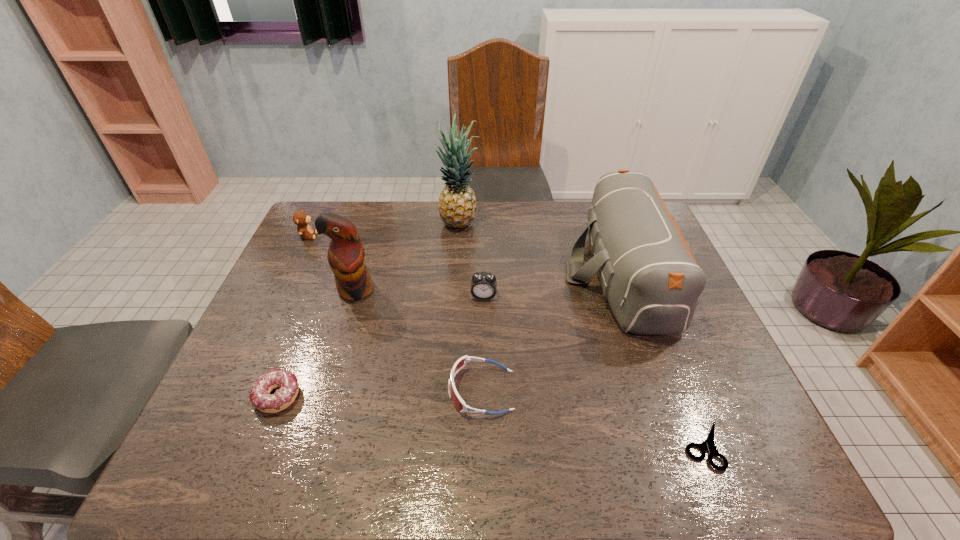
Where is `vacant space that's between the doughnut and the parrot`? This screenshot has width=960, height=540. vacant space that's between the doughnut and the parrot is located at coordinates (317, 343).

Where is `unoccupied position between the goggles and the alarm clock`? unoccupied position between the goggles and the alarm clock is located at coordinates (482, 343).

The height and width of the screenshot is (540, 960). Identify the location of free space between the nearest object and the sixth tallest object. (592, 418).

Identify which object is the sixth closest to the pineapple. Please provide its 2D coordinates. Your answer should be formatted as a tuple, i.e. [(x, y)], where the tuple contains the x and y coordinates of a point satisfying the conditions above.

[(260, 398)]

Identify which object is the seventh closest to the sixth tallest object. Please provide its 2D coordinates. Your answer should be formatted as a tuple, i.e. [(x, y)], where the tuple contains the x and y coordinates of a point satisfying the conditions above.

[(300, 218)]

At what (x,y) coordinates should I click in order to perform the action: click on vacant space that satisfies the following two spatial constraints: 1. on the face of the leftmost object; 2. on the back side of the sixth shortest object. Please return your answer as a coordinate pair (x, y). Image resolution: width=960 pixels, height=540 pixels. Looking at the image, I should click on (290, 273).

You are a GUI agent. You are given a task and a screenshot of the screen. Output one action in this format:
    pyautogui.click(x=<x>, y=<y>)
    Task: Click on the vacant space that satisfies the following two spatial constraints: 1. on the front side of the shortest object; 2. on the right side of the alarm clock
    The image size is (960, 540).
    Given the screenshot: What is the action you would take?
    pyautogui.click(x=485, y=446)